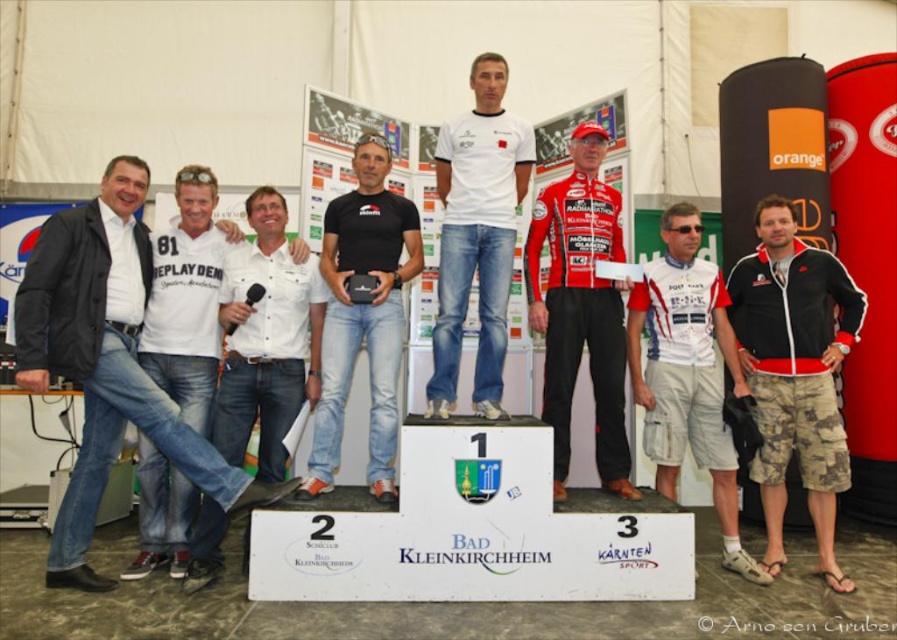
Question: Is the position of black/red zip-up jacket at right more distant than that of white cotton shirt at left?

Choices:
 (A) yes
 (B) no

Answer: (B)

Question: Can you confirm if white jersey at center is smaller than black matte jeans at center?

Choices:
 (A) yes
 (B) no

Answer: (B)

Question: Which of these objects is positioned farthest from the red jersey at center?

Choices:
 (A) white jersey at center
 (B) white cotton shirt at left
 (C) white cotton t-shirt at center

Answer: (B)

Question: Which of the following is the closest to the observer?

Choices:
 (A) black matte jeans at center
 (B) white cotton shirt at left

Answer: (A)

Question: Which point is closer to the camera?

Choices:
 (A) (98, 323)
 (B) (610, 298)

Answer: (A)

Question: Can you confirm if black/red zip-up jacket at right is positioned to the right of white cotton t-shirt at center?

Choices:
 (A) no
 (B) yes

Answer: (B)